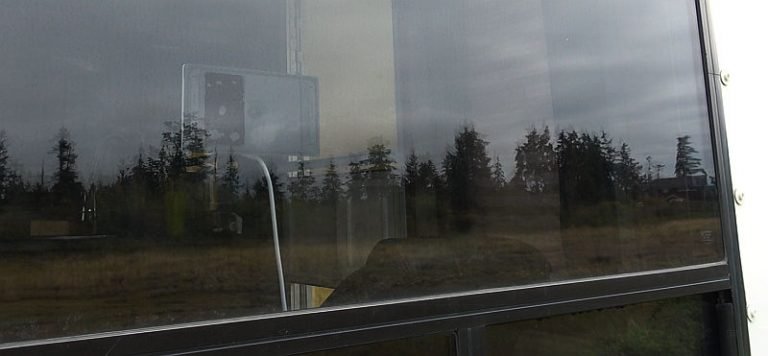
Locate an element on the screen. grey window frame is located at coordinates (666, 281), (729, 215).